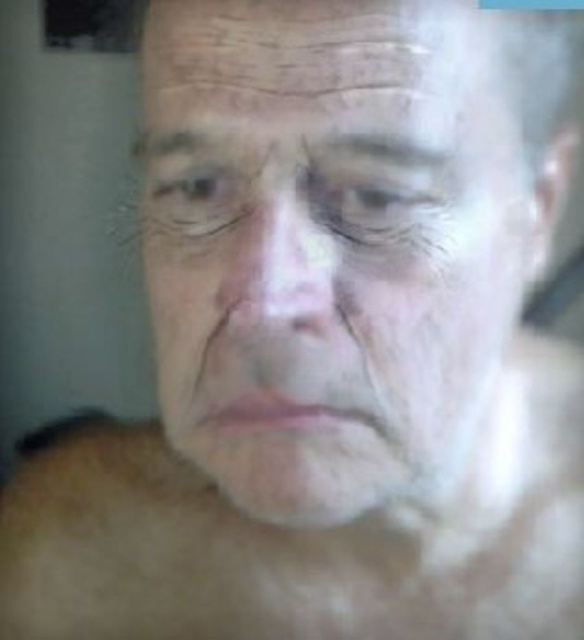
Question: Which point is farther to the camera?

Choices:
 (A) dry skin wrinkle at center
 (B) brown matte eye at upper left
 (C) dry skin forehead at upper center
 (D) smooth skin face at center

Answer: (B)

Question: Which point is farther to the camera?

Choices:
 (A) flesh-colored skin at center
 (B) brown matte eye at upper left
 (C) dry skin wrinkle at center

Answer: (A)

Question: Does flesh-colored skin at center have a smaller size compared to dry skin forehead at upper center?

Choices:
 (A) no
 (B) yes

Answer: (A)

Question: Is smooth skin face at center behind dry skin forehead at upper center?

Choices:
 (A) no
 (B) yes

Answer: (A)

Question: Which of these objects is positioned closest to the dry skin nose at center?

Choices:
 (A) translucent glass eye at center
 (B) dry skin wrinkle at center
 (C) flesh-colored skin at center
 (D) dry skin forehead at upper center

Answer: (B)

Question: Does dry skin nose at center have a larger size compared to dry skin wrinkle at center?

Choices:
 (A) no
 (B) yes

Answer: (B)